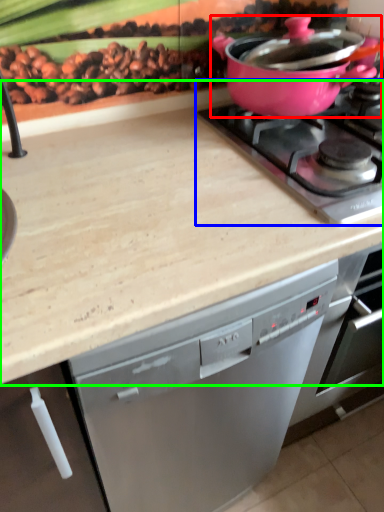
Question: Which object is the closest to the kitchen appliance (highlighted by a red box)? Choose among these: gas stove (highlighted by a blue box) or countertop (highlighted by a green box).

Choices:
 (A) gas stove
 (B) countertop

Answer: (A)